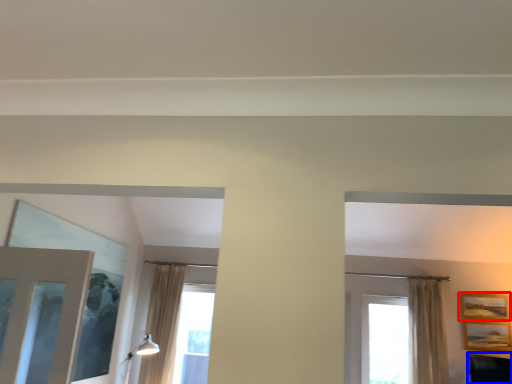
Question: Which object appears farthest to the camera in this image, picture frame (highlighted by a red box) or furniture (highlighted by a blue box)?

Choices:
 (A) picture frame
 (B) furniture

Answer: (A)